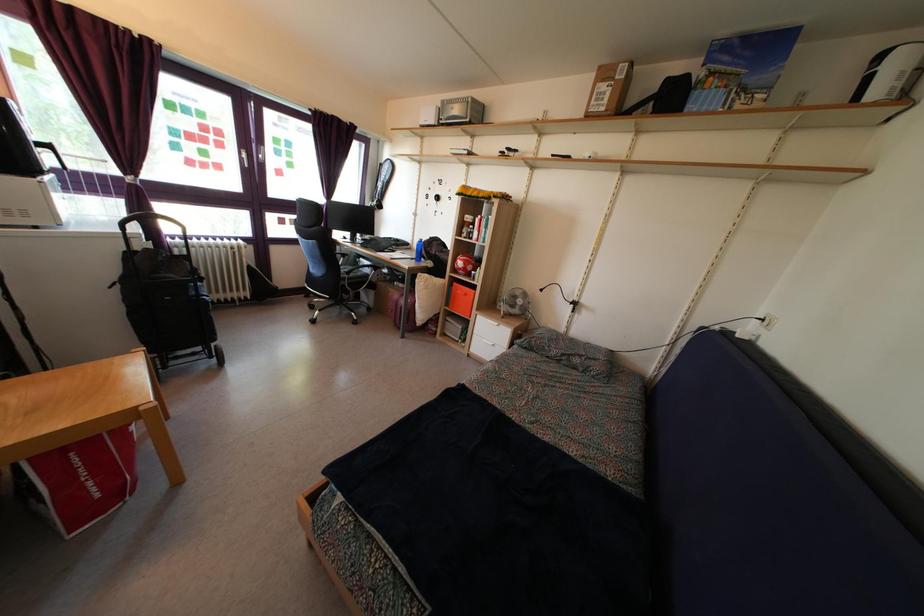
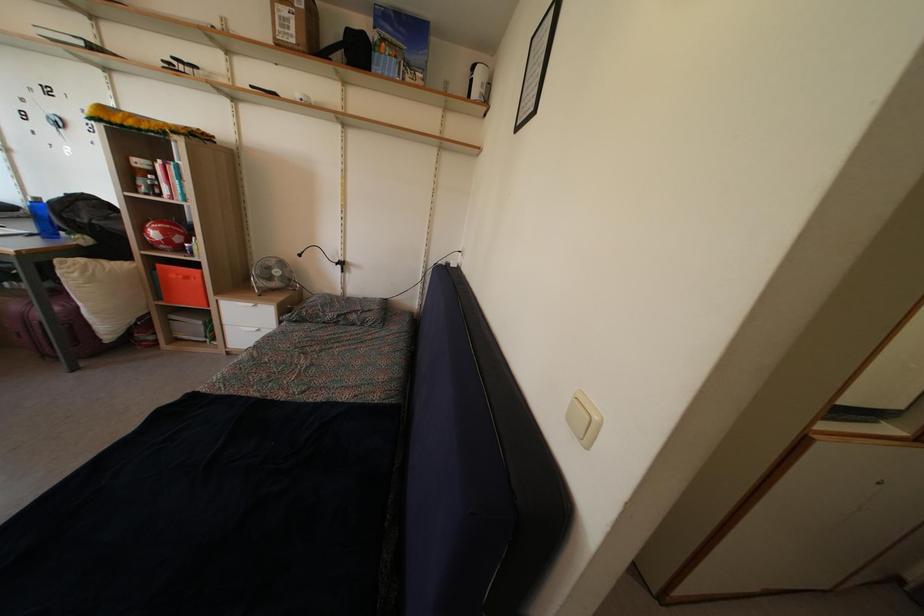
The point at (477, 344) is marked in the first image. Where is the corresponding point in the second image?

(228, 336)